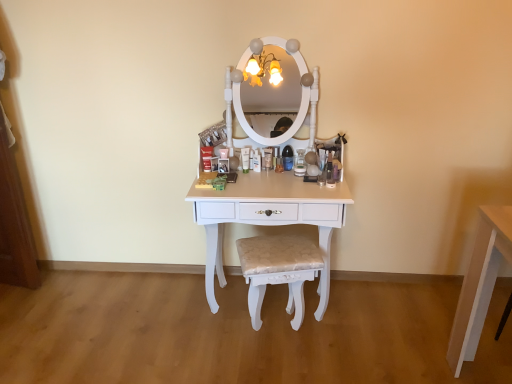
Identify the location of unoccupied area in front of white glossy table at center. (275, 360).